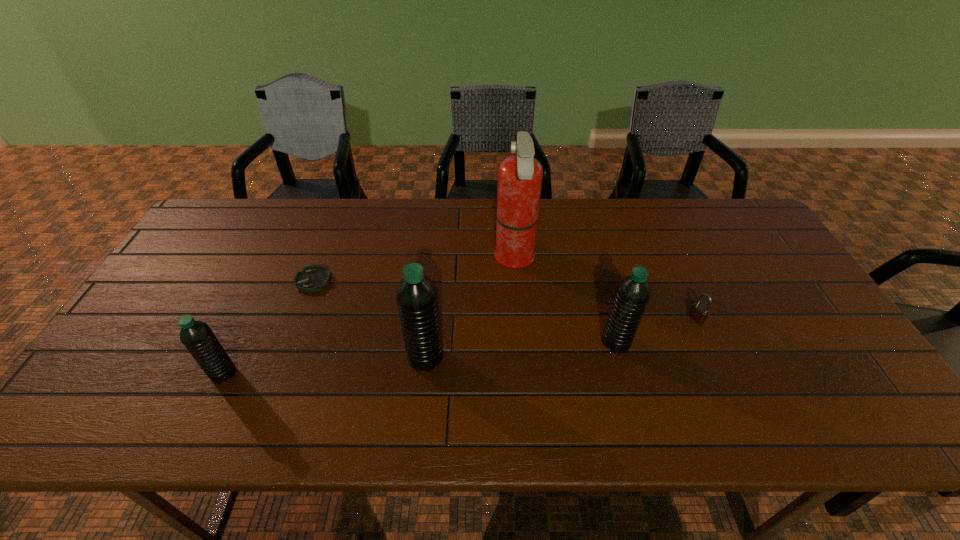
Where is `vacant point that satisfies the following two spatial constraints: 1. on the front side of the padlock; 2. on the left side of the fifth object from right to left`? The height and width of the screenshot is (540, 960). vacant point that satisfies the following two spatial constraints: 1. on the front side of the padlock; 2. on the left side of the fifth object from right to left is located at coordinates (300, 319).

Where is `free space that satisfies the following two spatial constraints: 1. with the handle and hose on the third object from right to left; 2. on the right side of the third tallest object`? free space that satisfies the following two spatial constraints: 1. with the handle and hose on the third object from right to left; 2. on the right side of the third tallest object is located at coordinates (522, 342).

Find the location of a particular element. This screenshot has height=540, width=960. free region that satisfies the following two spatial constraints: 1. with the handle and hose on the third object from right to left; 2. on the back side of the third tallest object is located at coordinates (522, 342).